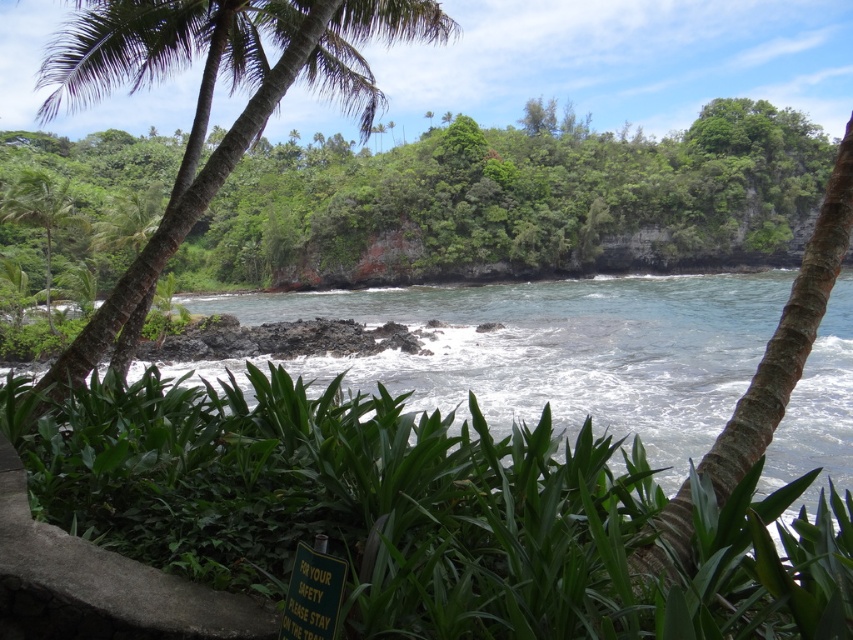
You are standing at the shoreline and see the clear blue water at center and the green leafy palm tree at left. Which object is wider from your perspective?

The clear blue water at center is wider than the green leafy palm tree at left according to the description.